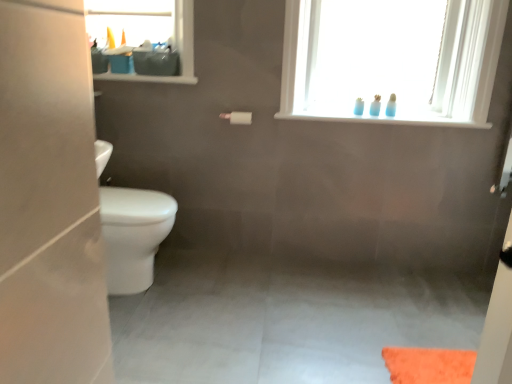
Where is `free spot to the right of blue translucent toothbrushes at upper right, arranged as the 1th toiletry when viewed from the right`? free spot to the right of blue translucent toothbrushes at upper right, arranged as the 1th toiletry when viewed from the right is located at coordinates (413, 114).